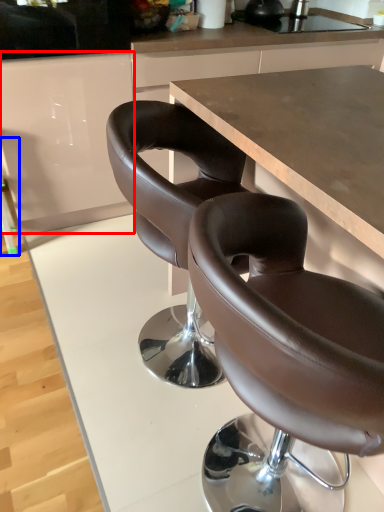
Question: Which of the following is the farthest to the observer, cabinetry (highlighted by a red box) or bar stool (highlighted by a blue box)?

Choices:
 (A) cabinetry
 (B) bar stool

Answer: (B)